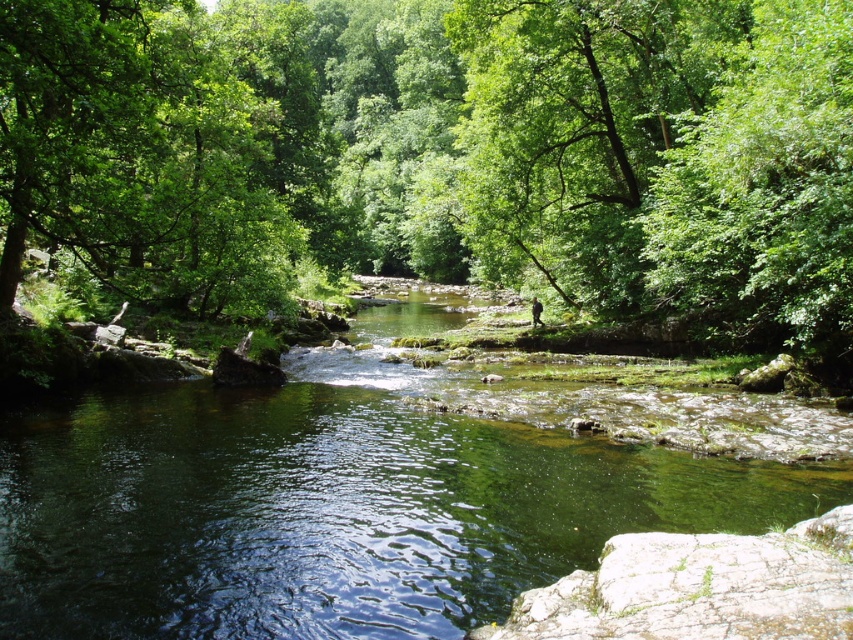
You are a hiker trying to cross the river in the scene. You see the green leafy forest at center and the camouflage fabric man at center. Which object is larger and might provide better shelter from the rain?

The green leafy forest at center is bigger than the camouflage fabric man at center, so it would provide better shelter from the rain.

You are standing in the middle of the green leafy forest at center and want to walk towards the green leafy tree at upper right. Which direction should you head to get closer to the tree?

The green leafy tree at upper right is further away than the green leafy forest at center, so you should head towards the upper right direction to get closer to the tree.